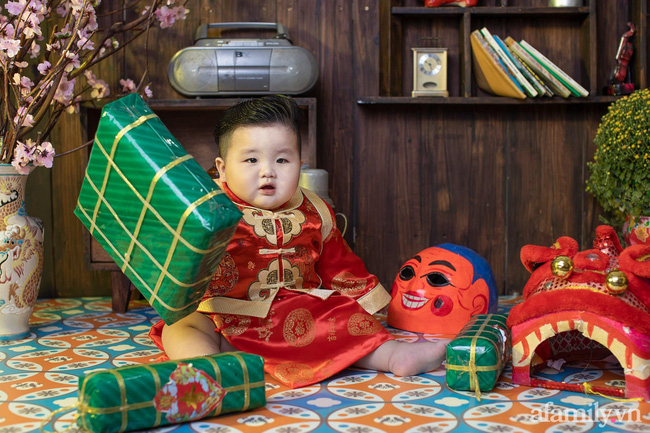
Where is `vase`? vase is located at coordinates [x=21, y=243].